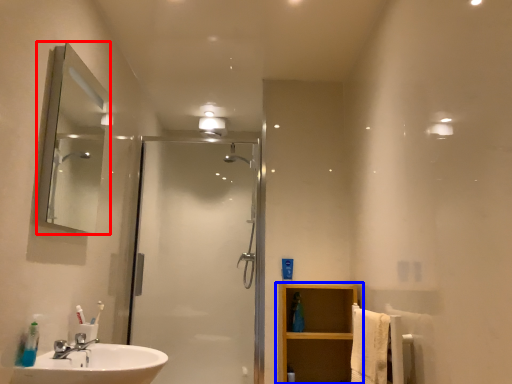
Question: Which object is further to the camera taking this photo, mirror (highlighted by a red box) or bathroom cabinet (highlighted by a blue box)?

Choices:
 (A) mirror
 (B) bathroom cabinet

Answer: (B)